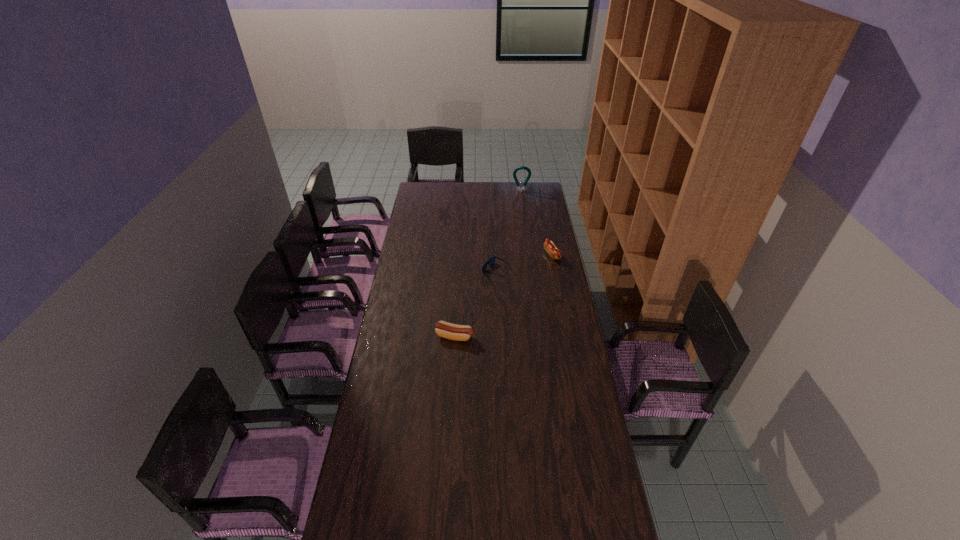
I want to click on blank space that satisfies the following two spatial constraints: 1. at the jaws of the farther sausage; 2. on the right side of the farthest object, so click(x=530, y=255).

Image resolution: width=960 pixels, height=540 pixels. In order to click on vacant point that satisfies the following two spatial constraints: 1. on the front side of the farther sausage; 2. at the front of the shortest object showing the lenses in this screenshot , I will do `click(555, 271)`.

Image resolution: width=960 pixels, height=540 pixels. I want to click on free location that satisfies the following two spatial constraints: 1. at the jaws of the farther sausage; 2. on the right side of the farthest object, so click(x=530, y=255).